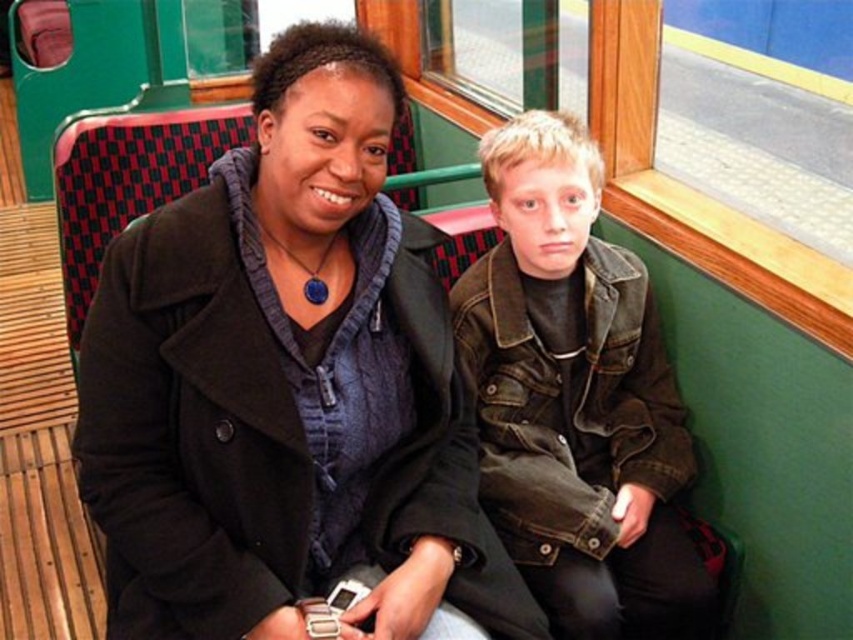
You are sitting in the train car and want to reach a snack placed at point (218,220) and a book at point (515,365). Which item is closer to you?

Point (218,220) is in front of point (515,365), so the snack is closer to you.

You are a passenger on a moving train and need to retrieve your bag from under the seat. The black woolen coat at center and the denim jacket at center are in your way. Which item should you move first to access the bag?

The black woolen coat at center is in front of the denim jacket at center, so you should move the black woolen coat at center first to access the bag.

You are a passenger on a moving train and want to place a 12 inch long backpack between the black woolen coat at center and the denim jacket at center. Can you fit it there?

The distance between the black woolen coat at center and denim jacket at center is 13.48 inches. Since the backpack is 12 inches long, it can fit in the space between them.